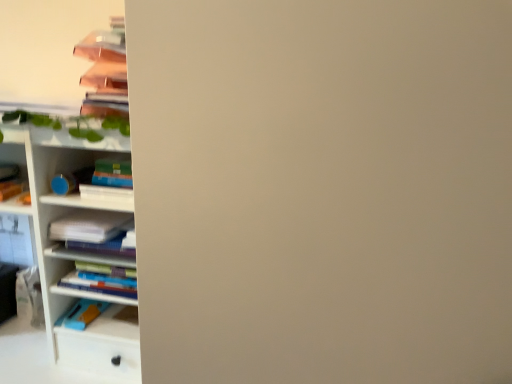
This screenshot has width=512, height=384. What do you see at coordinates (89, 226) in the screenshot?
I see `white paper at left` at bounding box center [89, 226].

Identify the location of white paper at left. (89, 226).

At what (x,y) coordinates should I click in order to perform the action: click on white glossy bookshelf at left. Please return your answer as a coordinate pair (x, y). Looking at the image, I should click on (61, 270).

The height and width of the screenshot is (384, 512). Describe the element at coordinates (61, 270) in the screenshot. I see `white glossy bookshelf at left` at that location.

Where is `white paper at left`? This screenshot has width=512, height=384. white paper at left is located at coordinates coord(89,226).

Between white glossy bookshelf at left and white paper at left, which one appears on the right side from the viewer's perspective?

From the viewer's perspective, white paper at left appears more on the right side.

Is white glossy bookshelf at left positioned in front of white paper at left?

Yes, white glossy bookshelf at left is closer to the camera.

Is point (48, 63) farther from viewer compared to point (53, 238)?

Yes, point (48, 63) is farther from viewer.

From the image's perspective, is white glossy bookshelf at left below white paper at left?

Actually, white glossy bookshelf at left appears above white paper at left in the image.

From a real-world perspective, which is physically below, white glossy bookshelf at left or white paper at left?

In real-world perspective, white paper at left is lower.

Considering the sizes of objects white glossy bookshelf at left and white paper at left in the image provided, who is wider, white glossy bookshelf at left or white paper at left?

Wider between the two is white paper at left.

Which of these two, white glossy bookshelf at left or white paper at left, stands shorter?

Standing shorter between the two is white paper at left.

Is white glossy bookshelf at left smaller than white paper at left?

Incorrect, white glossy bookshelf at left is not smaller in size than white paper at left.

Could white paper at left be considered to be inside white glossy bookshelf at left?

No.

Is white glossy bookshelf at left far from white paper at left?

white glossy bookshelf at left is near white paper at left, not far away.

Could you tell me if white glossy bookshelf at left is facing white paper at left?

No, white glossy bookshelf at left does not turn towards white paper at left.

The height and width of the screenshot is (384, 512). Find the location of `book on the right of white glossy bookshelf at left`. book on the right of white glossy bookshelf at left is located at coordinates (89, 226).

Is white paper at left at the left side of white glossy bookshelf at left?

No.

Between white paper at left and white glossy bookshelf at left, which one is positioned behind?

Positioned behind is white paper at left.

Is point (92, 236) positioned in front of point (123, 9)?

Yes, point (92, 236) is in front of point (123, 9).

From the image's perspective, is white paper at left beneath white glossy bookshelf at left?

Yes, from the image's perspective, white paper at left is beneath white glossy bookshelf at left.

From a real-world perspective, who is located higher, white paper at left or white glossy bookshelf at left?

From a 3D spatial view, white glossy bookshelf at left is above.

Is white paper at left thinner than white glossy bookshelf at left?

Incorrect, the width of white paper at left is not less than that of white glossy bookshelf at left.

Considering the sizes of objects white paper at left and white glossy bookshelf at left in the image provided, who is shorter, white paper at left or white glossy bookshelf at left?

white paper at left.

Considering the sizes of objects white paper at left and white glossy bookshelf at left in the image provided, who is smaller, white paper at left or white glossy bookshelf at left?

white paper at left is smaller.

Is white paper at left inside the boundaries of white glossy bookshelf at left, or outside?

white paper at left is not enclosed by white glossy bookshelf at left.

Would you consider white paper at left to be distant from white glossy bookshelf at left?

white paper at left is near white glossy bookshelf at left, not far away.

Could you tell me if white paper at left is turned towards white glossy bookshelf at left?

Yes.

What are the coordinates of `shelf that is above the white paper at left (from a real-world perspective)` in the screenshot? It's located at (61, 270).

What are the coordinates of `book that is on the right side of white glossy bookshelf at left` in the screenshot? It's located at (89, 226).

Locate an element on the screen. The image size is (512, 384). shelf that is above the white paper at left (from a real-world perspective) is located at coordinates (61, 270).